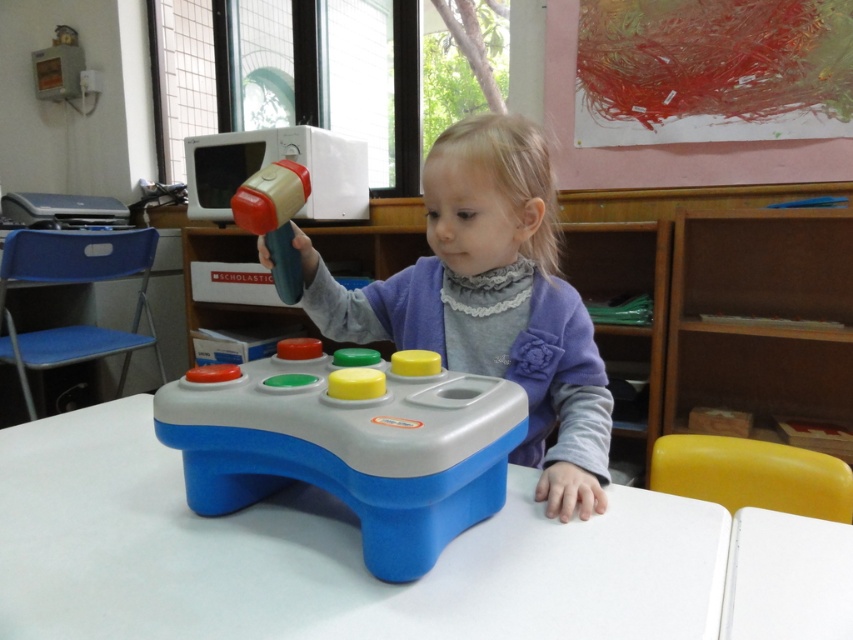
Based on the scene description, where is the matte plastic toddler at center located in terms of coordinates?

The matte plastic toddler at center is located at coordinates point [491,300].

You are a teacher in the classroom and want to move a toy from the blue plastic table at center to the matte plastic toddler at center. Which direction should you move the toy?

The blue plastic table at center is positioned on the left side of the matte plastic toddler at center, so you should move the toy to the right.